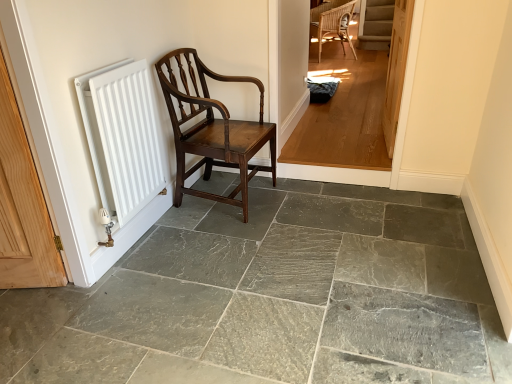
Question: Considering their positions, is polished dark wood chair at left located in front of or behind white matte radiator at left?

Choices:
 (A) front
 (B) behind

Answer: (B)

Question: Is point (170, 120) positioned closer to the camera than point (145, 69)?

Choices:
 (A) farther
 (B) closer

Answer: (A)

Question: Which is nearer to the light brown wood floor at center?

Choices:
 (A) gray slate floor at center
 (B) white matte radiator at left
 (C) light brown wooden door at center
 (D) polished dark wood chair at left

Answer: (C)

Question: Based on their relative distances, which object is nearer to the white matte radiator at left?

Choices:
 (A) gray slate floor at center
 (B) polished dark wood chair at left
 (C) light brown wooden door at center
 (D) light brown wood floor at center

Answer: (B)